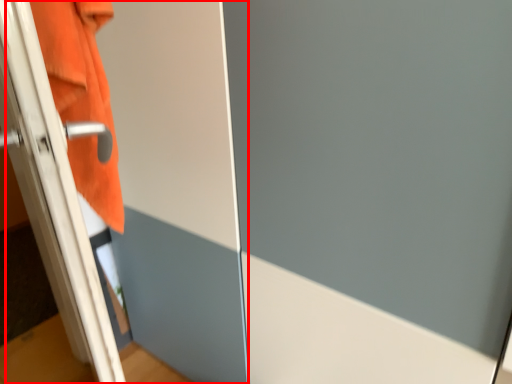
Question: From the image's perspective, where is screen door (annotated by the red box) located in relation to bath towel in the image?

Choices:
 (A) below
 (B) above

Answer: (A)